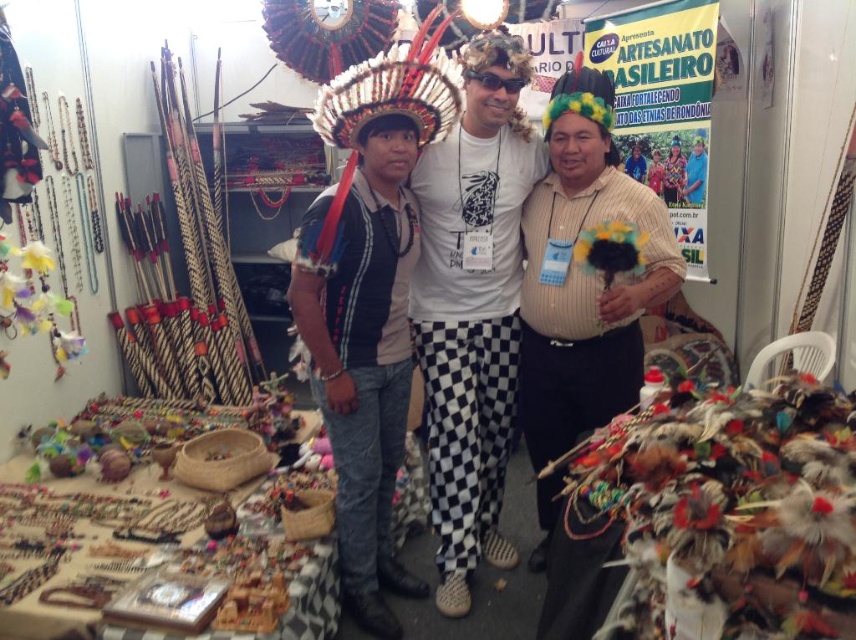
You are standing at the entrance of the booth and want to approach the matte black jacket at center. Which direction should you move to reach it?

Since the matte black jacket at center is located at coordinates point (473, 307), you should move forward from the entrance to reach it.

You are at the fair and want to take a photo of both the shiny metallic headdress at center and the matte black headdress at center. Which one should you focus on first if you want to capture both in the same frame without moving your camera?

The shiny metallic headdress at center is above the matte black headdress at center, so you should focus on the shiny metallic headdress at center first to ensure both are in the frame.